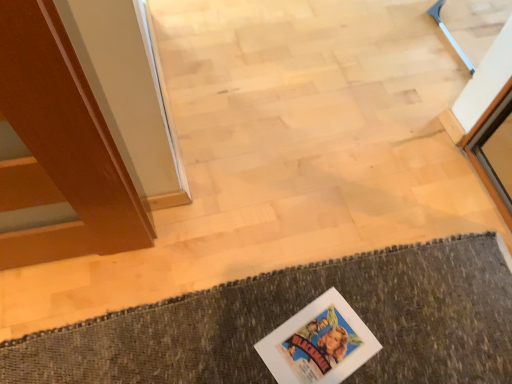
Identify the location of free spot to the right of colorful paper comic book at lower center. (401, 333).